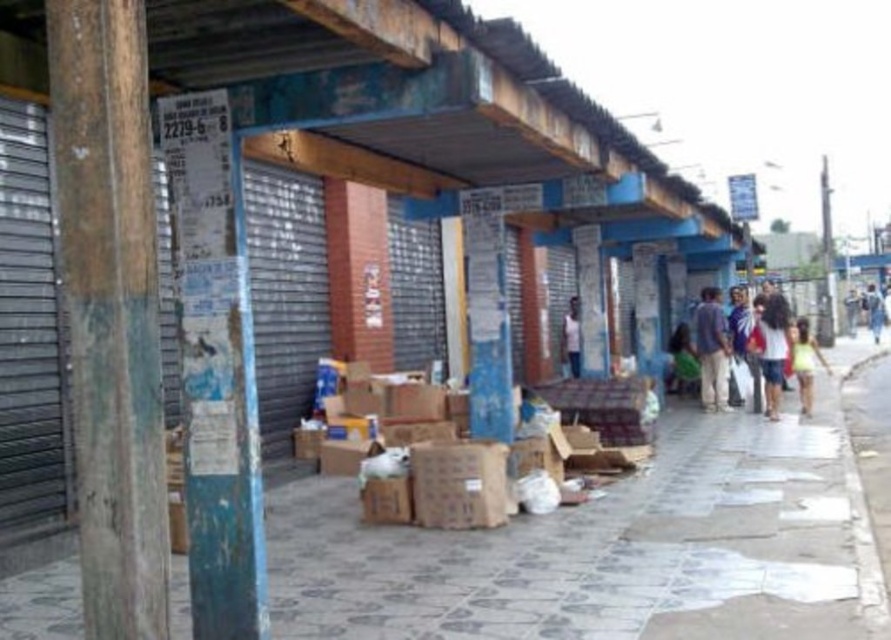
Question: Which object appears farthest from the camera in this image?

Choices:
 (A) yellow fabric person at center
 (B) light pink fabric shirt at center

Answer: (B)

Question: In this image, where is gray concrete pavement at center located relative to yellow fabric person at center?

Choices:
 (A) below
 (B) above

Answer: (A)

Question: Which point appears farthest from the camera in this image?

Choices:
 (A) (567, 340)
 (B) (804, 378)

Answer: (A)

Question: Is brown cardboard crate at center below light blue denim shorts at lower right?

Choices:
 (A) yes
 (B) no

Answer: (A)

Question: Which object is positioned farthest from the light pink fabric shirt at center?

Choices:
 (A) white cotton shirt at right
 (B) brown cardboard crate at center
 (C) weathered wood pole at left

Answer: (C)

Question: Is the position of gray concrete pavement at center less distant than that of light pink fabric shirt at center?

Choices:
 (A) no
 (B) yes

Answer: (B)